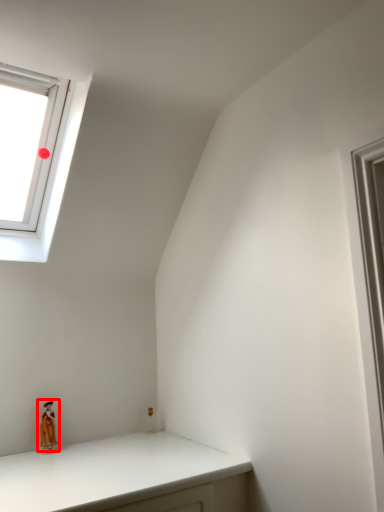
Question: From the image's perspective, where is doll (annotated by the red box) located relative to window?

Choices:
 (A) above
 (B) below

Answer: (B)